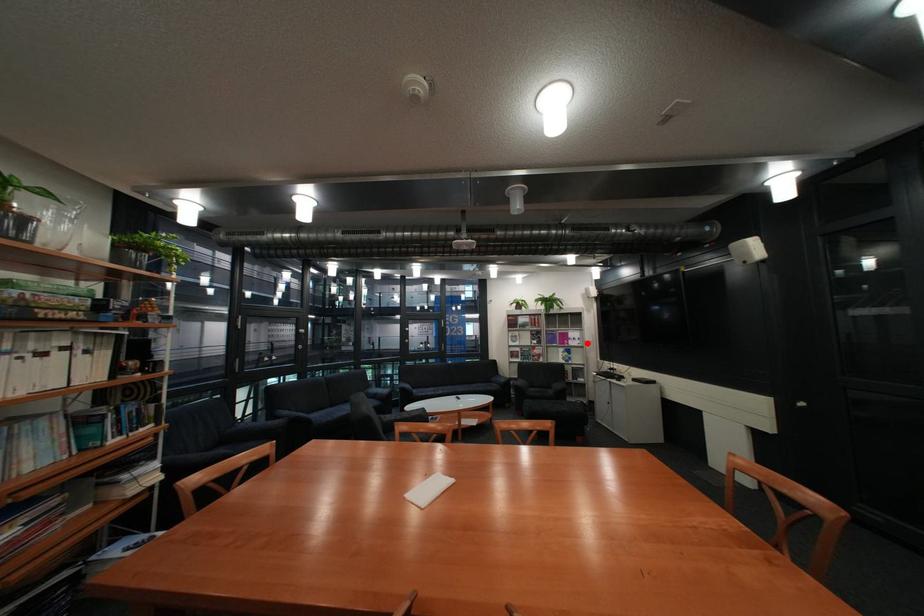
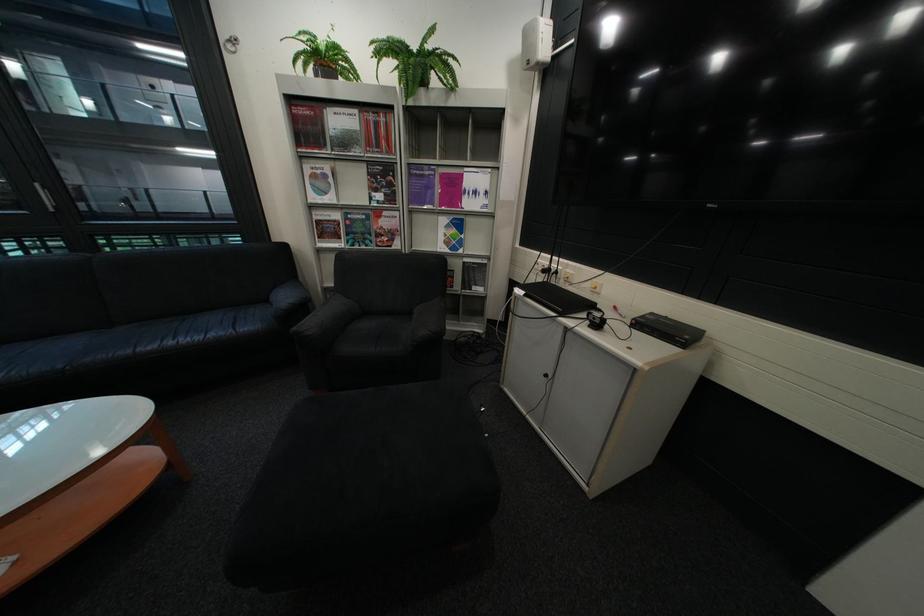
Question: I am providing you with two images of the same scene from different viewpoints. Given a red point in image1, look at the same physical point in image2. Is it:

Choices:
 (A) Closer to the viewpoint
 (B) Farther from the viewpoint

Answer: (A)